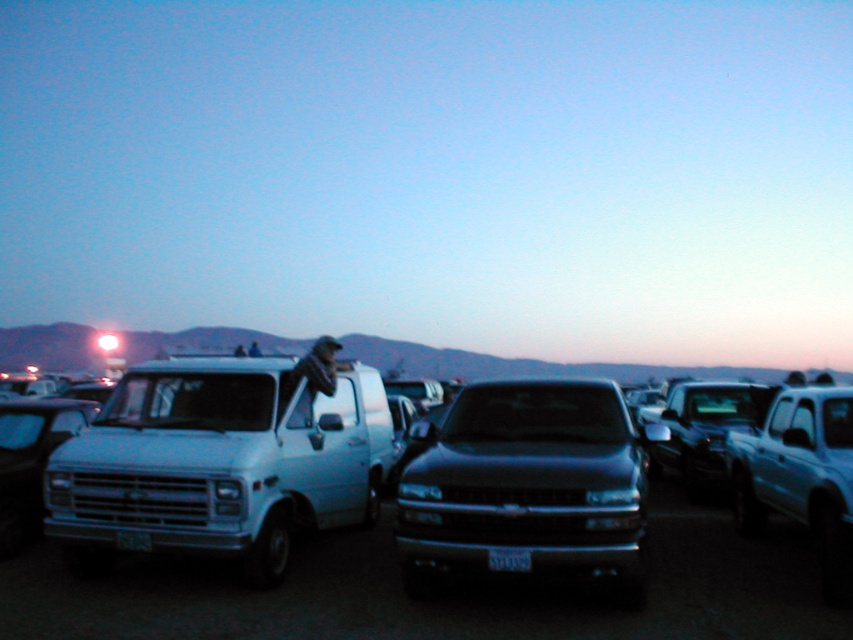
Is metallic silver truck at center positioned behind black glossy pickup truck at center?

Yes, it is behind black glossy pickup truck at center.

Can you confirm if metallic silver truck at center is shorter than black glossy pickup truck at center?

Yes.

The image size is (853, 640). What do you see at coordinates (444, 593) in the screenshot? I see `metallic silver truck at center` at bounding box center [444, 593].

Locate an element on the screen. metallic silver truck at center is located at coordinates (444, 593).

Between white matte van at center and black plastic license plate at center, which one appears on the right side from the viewer's perspective?

black plastic license plate at center is more to the right.

Does point (314, 403) lie in front of point (517, 568)?

No, it is not.

Identify the location of white matte van at center. The height and width of the screenshot is (640, 853). (219, 461).

Can you confirm if white matte van at center is shorter than black glossy pickup truck at center?

Incorrect, white matte van at center's height does not fall short of black glossy pickup truck at center's.

Which of these two, white matte van at center or black glossy pickup truck at center, stands taller?

white matte van at center is taller.

Does point (195, 440) lie in front of point (492, 481)?

No.

Where is `white matte van at center`? white matte van at center is located at coordinates click(219, 461).